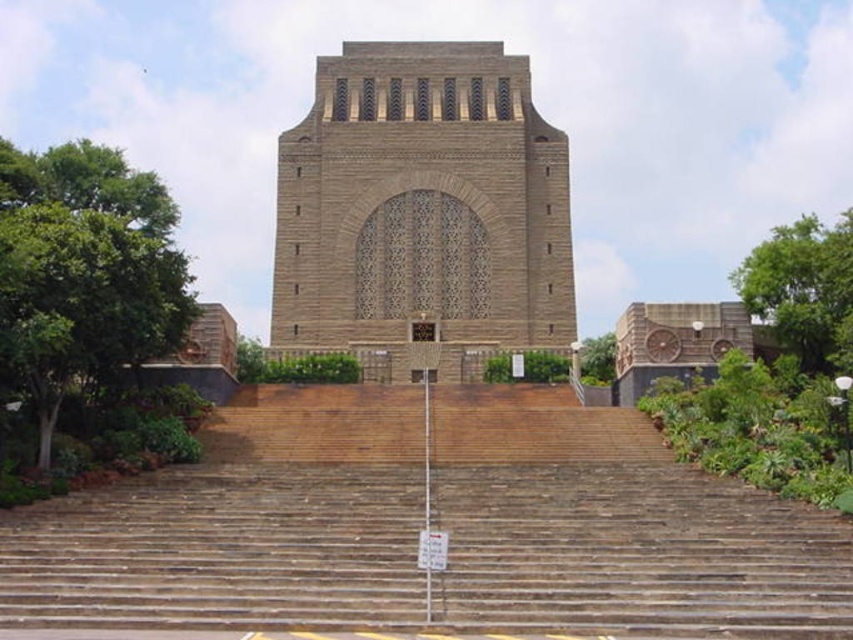
Question: Among these objects, which one is farthest from the camera?

Choices:
 (A) green leafy tree at left
 (B) green leafy tree at right
 (C) green leafy tree at center
 (D) brown wooden stairs at center

Answer: (C)

Question: In this image, where is brown stone tower at center located relative to green leafy tree at center?

Choices:
 (A) below
 (B) above

Answer: (B)

Question: Does brown stone tower at center come in front of green leafy tree at center?

Choices:
 (A) yes
 (B) no

Answer: (B)

Question: Which point is farther to the camera?

Choices:
 (A) brown stone tower at center
 (B) brown stone clock tower at right
 (C) green leafy tree at center

Answer: (A)

Question: Does brown stone tower at center come in front of green leafy tree at left?

Choices:
 (A) yes
 (B) no

Answer: (B)

Question: Which of the following is the closest to the observer?

Choices:
 (A) brown stone tower at center
 (B) brown stone clock tower at right
 (C) green leafy tree at center
 (D) green leafy tree at right

Answer: (D)